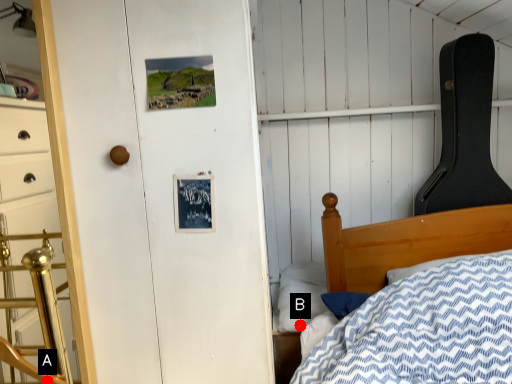
Question: Two points are circled on the image, labeled by A and B beside each circle. Which point is closer to the camera?

Choices:
 (A) A is closer
 (B) B is closer

Answer: (A)